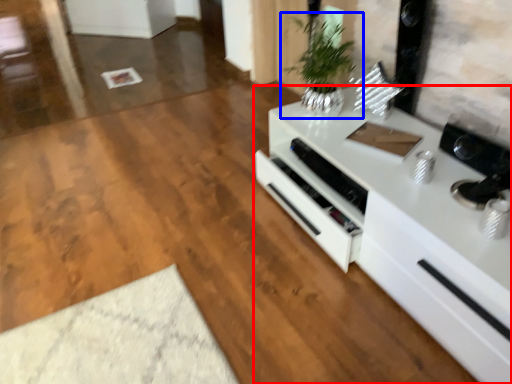
Question: Which object is closer to the camera taking this photo, countertop (highlighted by a red box) or houseplant (highlighted by a blue box)?

Choices:
 (A) countertop
 (B) houseplant

Answer: (A)